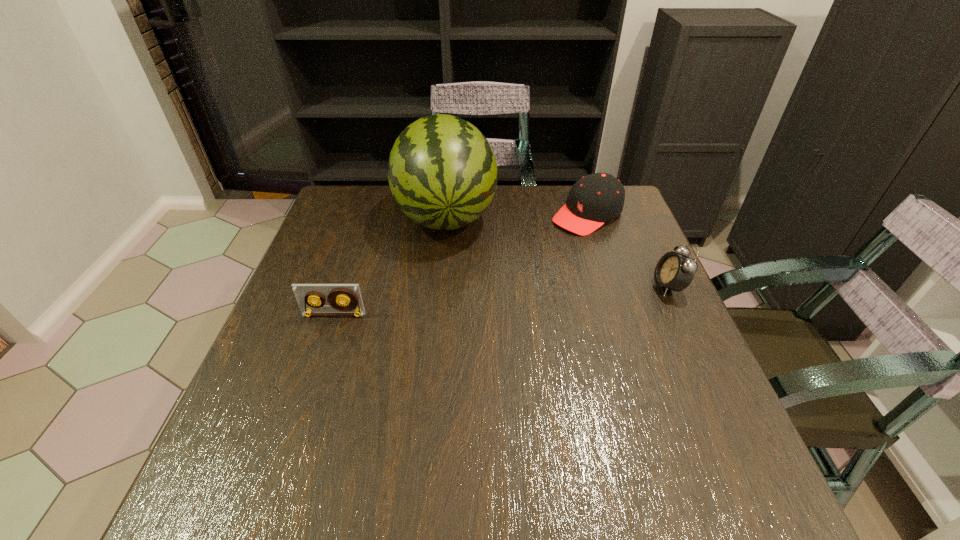
The width and height of the screenshot is (960, 540). Find the location of `cap located in the right edge section of the desktop`. cap located in the right edge section of the desktop is located at coordinates [x=597, y=198].

This screenshot has height=540, width=960. What are the coordinates of `object that is at the far right corner` in the screenshot? It's located at (597, 198).

Identify the location of free space at the far edge of the desktop. (503, 224).

Find the location of a particular element. The image size is (960, 540). vacant region at the near edge of the desktop is located at coordinates (411, 413).

You are a GUI agent. You are given a task and a screenshot of the screen. Output one action in this format:
    pyautogui.click(x=<x>, y=<y>)
    Task: Click on the free space at the left edge of the desktop
    The width and height of the screenshot is (960, 540).
    Given the screenshot: What is the action you would take?
    pyautogui.click(x=267, y=343)

At what (x,y) coordinates should I click in order to perform the action: click on vacant space at the right edge of the desktop. Please return your answer as a coordinate pair (x, y). The width and height of the screenshot is (960, 540). Looking at the image, I should click on (624, 355).

In the image, there is a desktop. Where is `vacant space at the near right corner`? This screenshot has height=540, width=960. vacant space at the near right corner is located at coordinates (668, 408).

At what (x,y) coordinates should I click in order to perform the action: click on empty space between the second nearest object and the cap. Please return your answer as a coordinate pair (x, y). The width and height of the screenshot is (960, 540). Looking at the image, I should click on (628, 251).

At what (x,y) coordinates should I click in order to perform the action: click on free space that is in between the tallest object and the shortest object. Please return your answer as a coordinate pair (x, y). Looking at the image, I should click on (390, 265).

You are a GUI agent. You are given a task and a screenshot of the screen. Output one action in this format:
    pyautogui.click(x=<x>, y=<y>)
    Task: Click on the vacant area that lies between the tallest object and the third farthest object
    This screenshot has height=540, width=960.
    Given the screenshot: What is the action you would take?
    pyautogui.click(x=557, y=251)